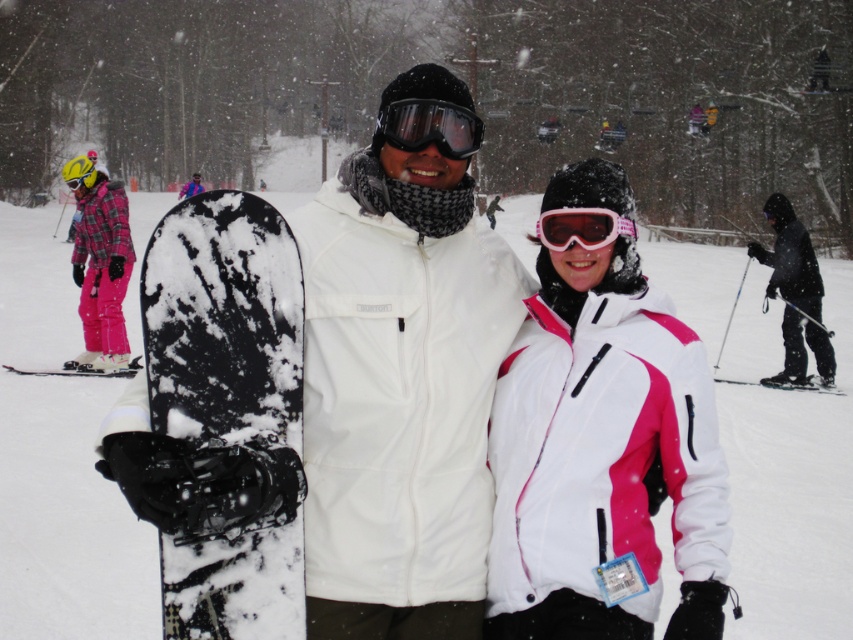
Based on the photo, between white matte snowboard at center and plaid fabric snowsuit at left, which one has more height?

white matte snowboard at center is taller.

You are a GUI agent. You are given a task and a screenshot of the screen. Output one action in this format:
    pyautogui.click(x=<x>, y=<y>)
    Task: Click on the white matte snowboard at center
    
    Given the screenshot: What is the action you would take?
    pyautogui.click(x=409, y=388)

Between plaid fabric snowsuit at left and black matte ski suit at right, which one is positioned lower?

plaid fabric snowsuit at left is lower down.

Find the location of a particular element. This screenshot has height=640, width=853. plaid fabric snowsuit at left is located at coordinates (99, 264).

Is point (78, 280) more distant than point (807, 339)?

No.

The image size is (853, 640). Identify the location of plaid fabric snowsuit at left. (99, 264).

Who is shorter, white matte snowboard at center or black matte ski at lower right?

Standing shorter between the two is black matte ski at lower right.

Can you confirm if white matte snowboard at center is positioned to the right of black matte ski at lower right?

Incorrect, white matte snowboard at center is not on the right side of black matte ski at lower right.

Locate an element on the screen. The width and height of the screenshot is (853, 640). white matte snowboard at center is located at coordinates (409, 388).